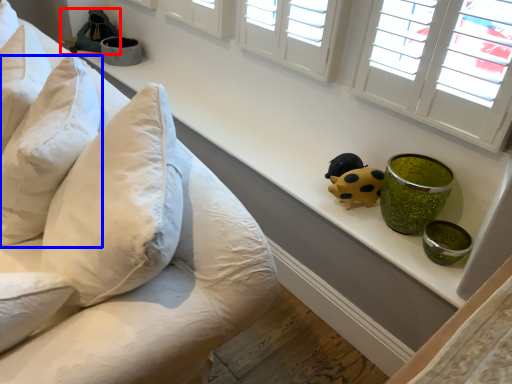
Question: Which of the following is the closest to the observer, toy (highlighted by a red box) or pillow (highlighted by a blue box)?

Choices:
 (A) toy
 (B) pillow

Answer: (B)